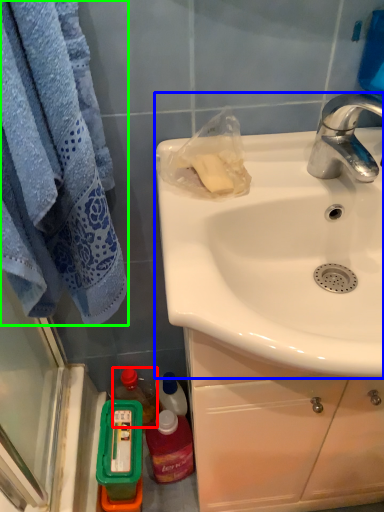
Question: Estimate the real-world distances between objects in this image. Which object is farther from bottle (highlighted by a red box), sink (highlighted by a blue box) or towel/napkin (highlighted by a green box)?

Choices:
 (A) sink
 (B) towel/napkin

Answer: (A)